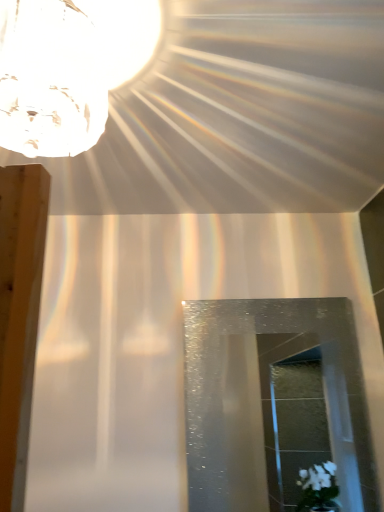
Question: In the image, is crystal glass lampshade at upper left on the left side or the right side of transparent textured glass door at center?

Choices:
 (A) right
 (B) left

Answer: (B)

Question: Considering their positions, is crystal glass lampshade at upper left located in front of or behind transparent textured glass door at center?

Choices:
 (A) front
 (B) behind

Answer: (A)

Question: Based on their sizes in the image, would you say crystal glass lampshade at upper left is bigger or smaller than transparent textured glass door at center?

Choices:
 (A) small
 (B) big

Answer: (B)

Question: From a real-world perspective, is transparent textured glass door at center physically located above or below crystal glass lampshade at upper left?

Choices:
 (A) above
 (B) below

Answer: (B)

Question: Is transparent textured glass door at center bigger or smaller than crystal glass lampshade at upper left?

Choices:
 (A) small
 (B) big

Answer: (A)

Question: Which is correct: transparent textured glass door at center is inside crystal glass lampshade at upper left, or outside of it?

Choices:
 (A) inside
 (B) outside

Answer: (B)

Question: Visually, is transparent textured glass door at center positioned to the left or to the right of crystal glass lampshade at upper left?

Choices:
 (A) left
 (B) right

Answer: (B)